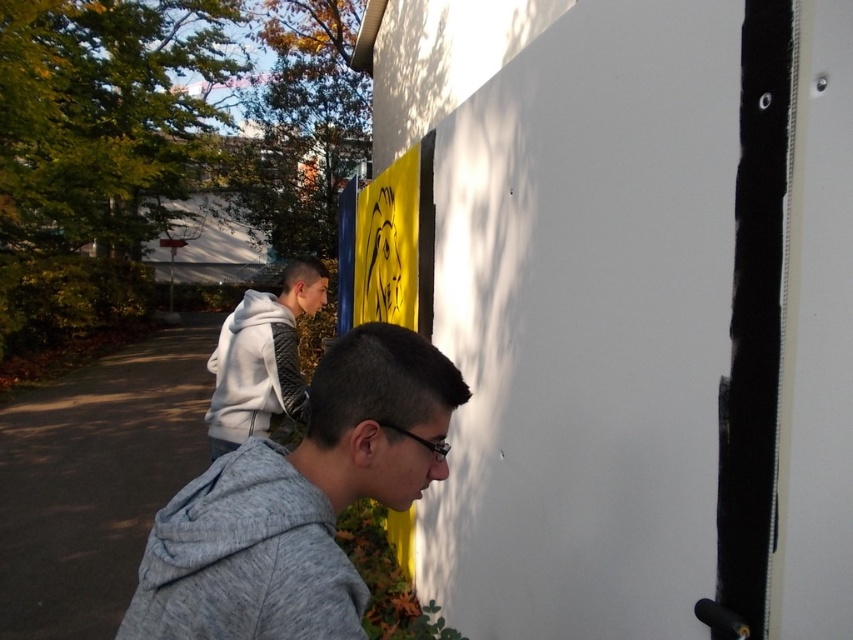
From the picture: Is gray fleece jacket at lower left wider than gray heathered sweatshirt at lower left?

Indeed, gray fleece jacket at lower left has a greater width compared to gray heathered sweatshirt at lower left.

Does gray fleece jacket at lower left appear on the left side of gray heathered sweatshirt at lower left?

Incorrect, gray fleece jacket at lower left is not on the left side of gray heathered sweatshirt at lower left.

Between point (305, 433) and point (131, 602), which one is positioned in front?

Point (305, 433) is in front.

The height and width of the screenshot is (640, 853). In order to click on gray fleece jacket at lower left in this screenshot , I will do `click(299, 500)`.

Is gray heathered sweatshirt at lower left further to camera compared to white hoodie at upper left?

No, gray heathered sweatshirt at lower left is closer to the viewer.

Identify the location of gray heathered sweatshirt at lower left. (247, 557).

From the picture: Which is above, gray fleece jacket at lower left or white hoodie at upper left?

Positioned higher is gray fleece jacket at lower left.

Does point (352, 625) come closer to viewer compared to point (268, 404)?

Yes, point (352, 625) is in front of point (268, 404).

Find the location of a particular element. The height and width of the screenshot is (640, 853). gray fleece jacket at lower left is located at coordinates tap(299, 500).